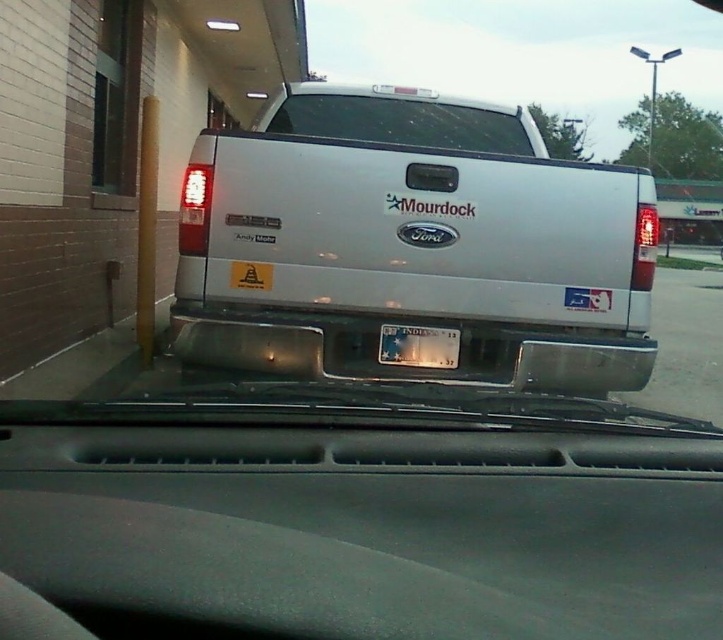
You are a photographer trying to capture the silver metallic pickup truck at center and the clear glass windshield at center in a single shot. Based on their sizes, which object would appear bigger in your photo?

The silver metallic pickup truck at center is larger in size than the clear glass windshield at center, so it would appear bigger in the photo.

You are a driver approaching the silver Ford pickup truck parked in the parking lot. You need to read the license plate of the white plastic license plate at center. Can you see it through the clear glass windshield at center?

The white plastic license plate at center is behind the clear glass windshield at center, so you cannot see it through the windshield.

In the scene shown: You are standing in front of the silver Ford pickup truck and want to check the clear glass windshield at center. Where should you look relative to the truck?

The clear glass windshield at center is located at point 0.188 on the x axis and 0.562 on the y axis relative to the truck.